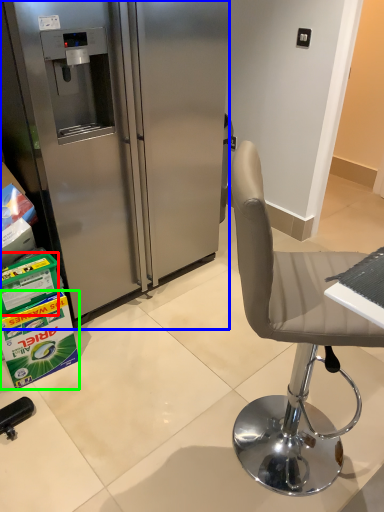
Question: Based on their relative distances, which object is nearer to box (highlighted by a red box)? Choose from refrigerator (highlighted by a blue box) and box (highlighted by a green box).

Choices:
 (A) refrigerator
 (B) box

Answer: (B)